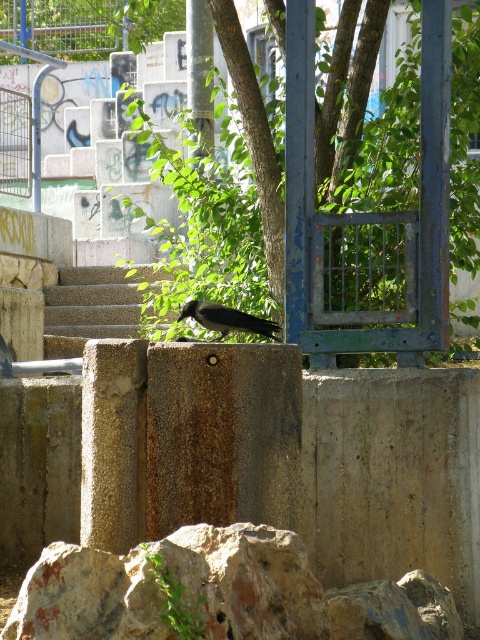
You are a delivery drone with a wingspan of 1.2 meters. You need to fly from the shiny black crow at center to the brown stone stairs at center. Can you safely navigate the space between them without hitting anything?

The distance between the shiny black crow at center and the brown stone stairs at center is 6.30 meters. Since your wingspan is only 1.2 meters, there is ample space for you to fly safely between them without any obstructions.

You are a bird flying over an urban park and want to land somewhere. You see a green leafy tree at center and brown stone stairs at center. Which one is larger in size?

The green leafy tree at center is bigger than the brown stone stairs at center, so the tree is larger in size.

You are a birdwatcher trying to observe the shiny black crow at center from the brown stone stairs at center. Can you see the crow clearly from your position on the stairs?

The brown stone stairs at center is taller than the shiny black crow at center, so you can see the crow clearly from the stairs because the stairs provide an elevated vantage point.